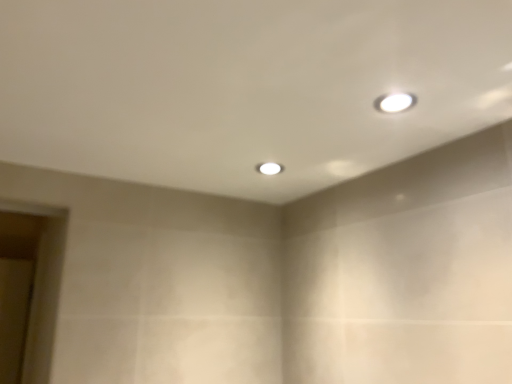
Locate an element on the screen. Image resolution: width=512 pixels, height=384 pixels. white glossy light fixture at center is located at coordinates (269, 168).

What do you see at coordinates (269, 168) in the screenshot? I see `white glossy light fixture at center` at bounding box center [269, 168].

Measure the distance between point (274, 165) and camera.

Point (274, 165) and camera are 1.38 meters apart from each other.

Identify the location of white glossy light fixture at center. The width and height of the screenshot is (512, 384). (269, 168).